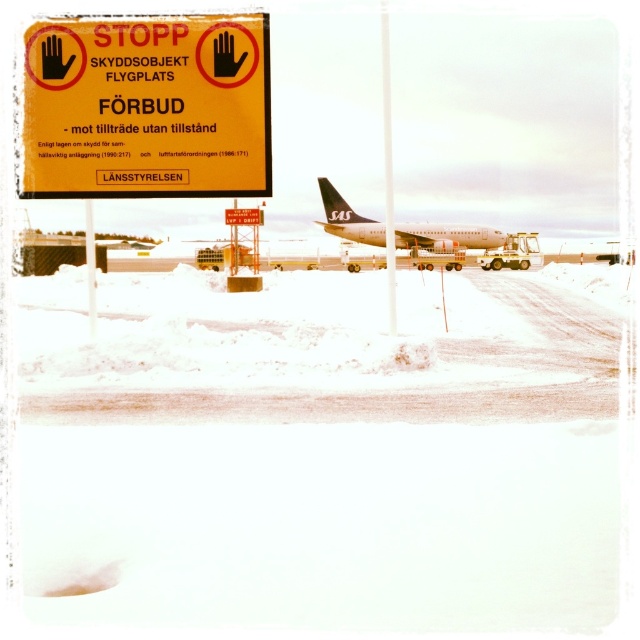
Question: Which is nearer to the metallic pole at center?

Choices:
 (A) yellow plastic sign at upper left
 (B) white asphalt tarmac at center
 (C) white matte airplane at center

Answer: (C)

Question: Which point is farther to the camera?

Choices:
 (A) yellow plastic sign at upper left
 (B) white matte airplane at center
 (C) white asphalt tarmac at center

Answer: (B)

Question: Is white asphalt tarmac at center to the left of metallic pole at center from the viewer's perspective?

Choices:
 (A) no
 (B) yes

Answer: (B)

Question: Can you confirm if yellow plastic sign at upper left is positioned below white matte airplane at center?

Choices:
 (A) no
 (B) yes

Answer: (A)

Question: Considering the relative positions of white asphalt tarmac at center and yellow plastic sign at upper left in the image provided, where is white asphalt tarmac at center located with respect to yellow plastic sign at upper left?

Choices:
 (A) left
 (B) right

Answer: (B)

Question: Which point is closer to the camera taking this photo?

Choices:
 (A) (387, 244)
 (B) (561, 371)

Answer: (B)